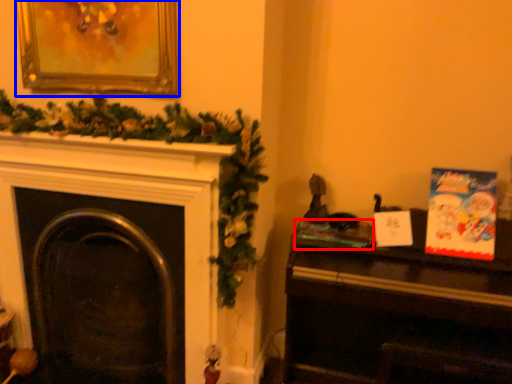
Question: Which of the following is the closest to the observer, book (highlighted by a red box) or picture frame (highlighted by a blue box)?

Choices:
 (A) book
 (B) picture frame

Answer: (B)